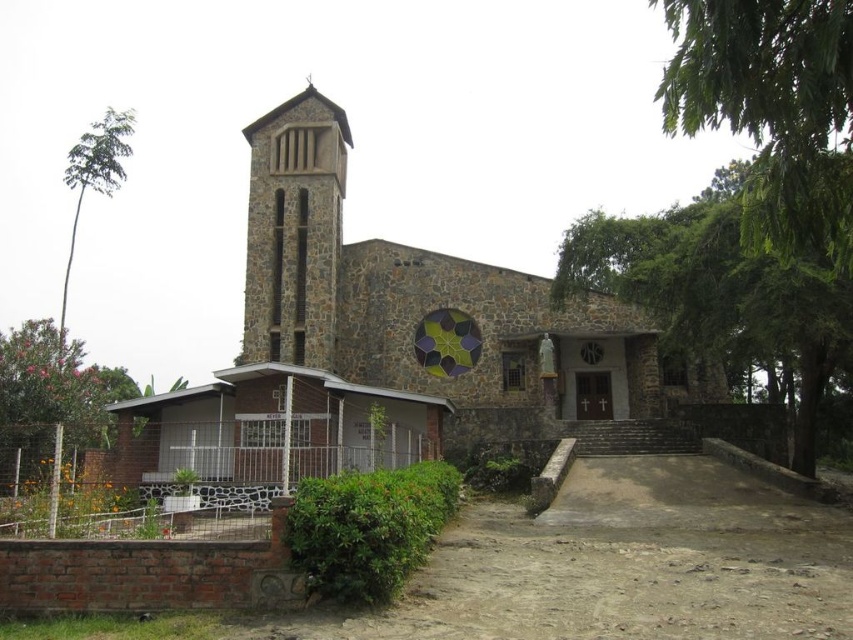
You are planning to install a new pathway between the two green leafy trees. The pathway requires a minimum of 200 feet to be safely constructed. Based on the scene, can the pathway be built between the green leafy tree at right and the green leafy tree at lower left?

The distance between the green leafy tree at right and the green leafy tree at lower left is 216.27 feet, which exceeds the minimum requirement of 200 feet. Therefore, the pathway can be safely constructed between them.

You are standing in front of the church and want to take a photo that includes both the green leafy tree at upper right and the brown stone bell tower at left. Which object should you adjust your camera angle to include first if you need to ensure both are fully visible?

You should adjust your camera angle to include the green leafy tree at upper right first since it might be wider than the brown stone bell tower at left, requiring more horizontal space in the frame.

You are standing in front of the church and want to take a photo of the green leafy tree at right. The camera you have can focus on objects up to 50 meters away. Will the tree be in focus?

The green leafy tree at right is 42.98 meters away from the camera. Since the camera can focus up to 50 meters, the tree is within the focus range and will be in focus.